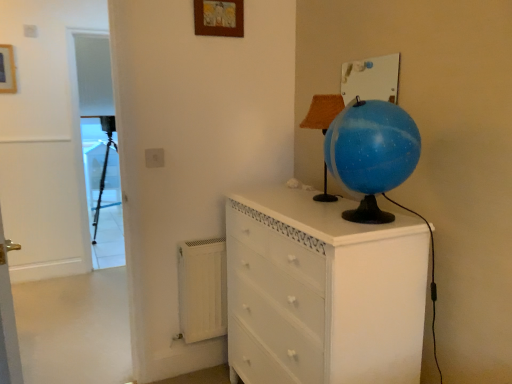
Where is `free spot below burlap-textured lampshade at upper center (from a real-world perspective)`? This screenshot has height=384, width=512. free spot below burlap-textured lampshade at upper center (from a real-world perspective) is located at coordinates (321, 196).